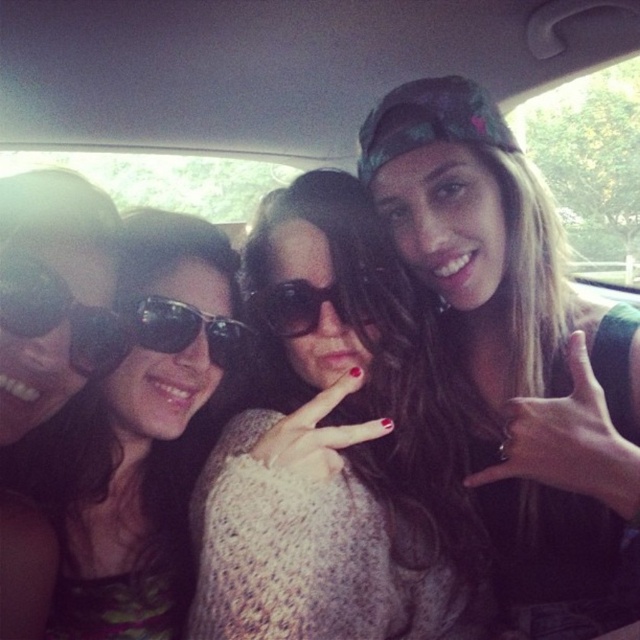
Question: Based on their relative distances, which object is nearer to the black reflective sunglasses at center?

Choices:
 (A) matte black sunglasses at left
 (B) knitted sweater at center

Answer: (A)

Question: Can you confirm if knitted sweater at center is bigger than matte black cap at upper right?

Choices:
 (A) yes
 (B) no

Answer: (B)

Question: Can you confirm if matte black sunglasses at left is positioned above black reflective sunglasses at center?

Choices:
 (A) yes
 (B) no

Answer: (B)

Question: Is matte black sunglasses at left wider than sunglasses at center?

Choices:
 (A) yes
 (B) no

Answer: (A)

Question: Which of these objects is positioned closest to the sunglasses at center?

Choices:
 (A) matte black sunglasses at left
 (B) knitted sweater at center

Answer: (B)

Question: Which point appears farthest from the camera in this image?

Choices:
 (A) pos(154,412)
 (B) pos(232,593)
 (C) pos(278,336)
 (D) pos(484,360)

Answer: (D)